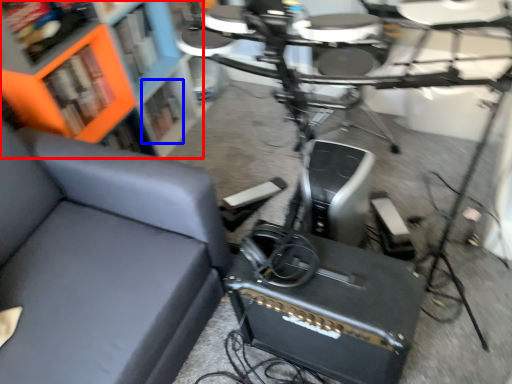
Question: Which of the following is the farthest to the observer, bookcase (highlighted by a red box) or shelf (highlighted by a blue box)?

Choices:
 (A) bookcase
 (B) shelf

Answer: (B)